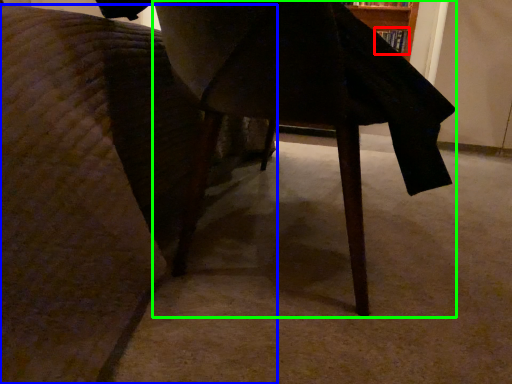
Question: Which object is positioned closest to book (highlighted by a red box)? Select from furniture (highlighted by a blue box) and table (highlighted by a green box).

Choices:
 (A) furniture
 (B) table

Answer: (B)